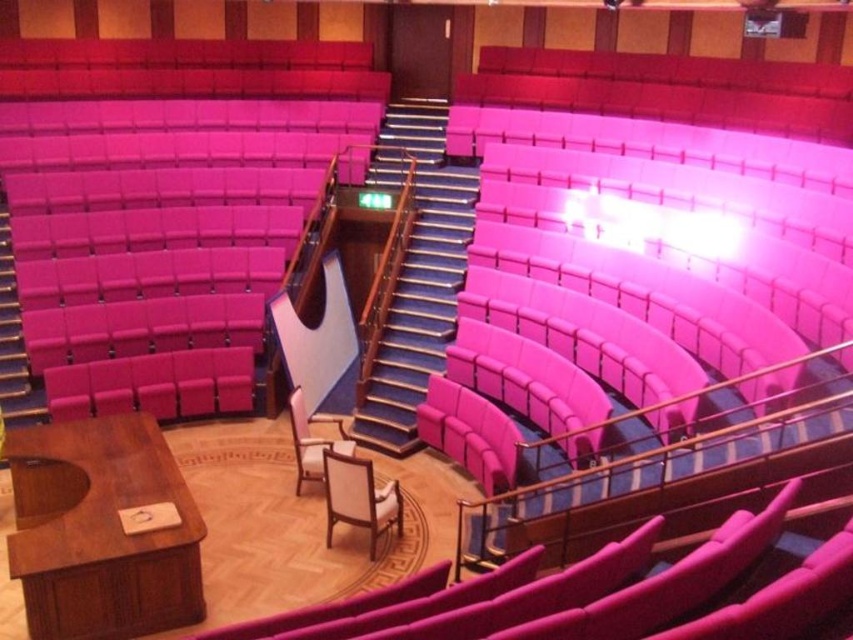
Does white fabric chair at center have a greater width compared to pink fabric chair at center?

Indeed, white fabric chair at center has a greater width compared to pink fabric chair at center.

This screenshot has height=640, width=853. Find the location of `white fabric chair at center`. white fabric chair at center is located at coordinates (358, 497).